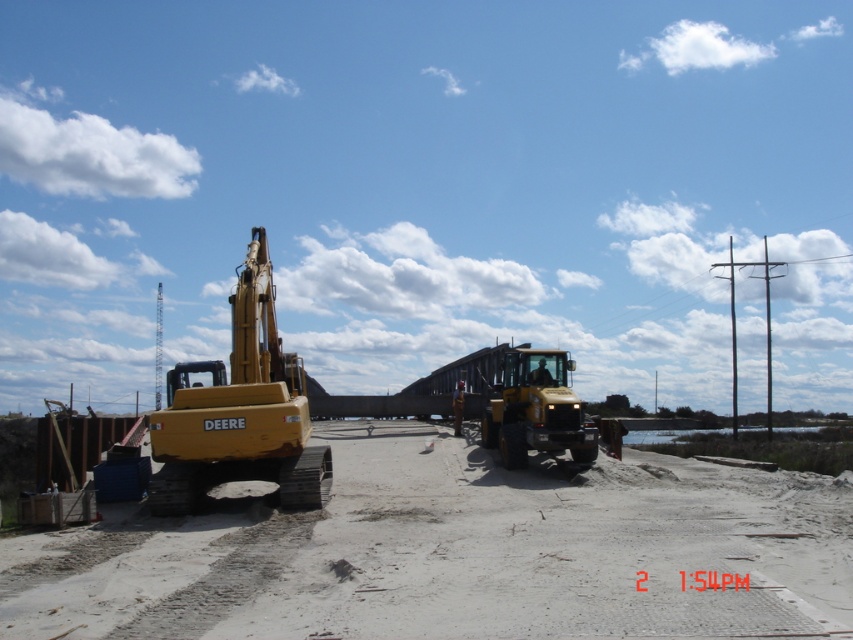
Who is positioned more to the right, dirt track at center or yellow metallic tractor at center?

Positioned to the right is yellow metallic tractor at center.

Which is below, dirt track at center or yellow metallic tractor at center?

dirt track at center

You are a GUI agent. You are given a task and a screenshot of the screen. Output one action in this format:
    pyautogui.click(x=<x>, y=<y>)
    Task: Click on the dirt track at center
    
    Given the screenshot: What is the action you would take?
    pyautogui.click(x=451, y=552)

Can you confirm if yellow rubber tracked excavator at left is taller than yellow metallic tractor at center?

Indeed, yellow rubber tracked excavator at left has a greater height compared to yellow metallic tractor at center.

Does yellow rubber tracked excavator at left appear on the right side of yellow metallic tractor at center?

No, yellow rubber tracked excavator at left is not to the right of yellow metallic tractor at center.

Locate an element on the screen. yellow rubber tracked excavator at left is located at coordinates (239, 410).

Based on the photo, can you confirm if dirt track at center is taller than yellow rubber tracked excavator at left?

No, dirt track at center is not taller than yellow rubber tracked excavator at left.

Is dirt track at center to the right of yellow rubber tracked excavator at left from the viewer's perspective?

Correct, you'll find dirt track at center to the right of yellow rubber tracked excavator at left.

Does point (289, 538) lie in front of point (256, 436)?

Yes, it is in front of point (256, 436).

This screenshot has height=640, width=853. Identify the location of dirt track at center. (451, 552).